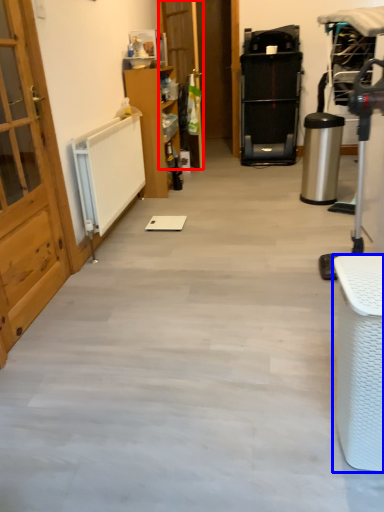
Question: Which object is further to the camera taking this photo, door (highlighted by a red box) or furniture (highlighted by a blue box)?

Choices:
 (A) door
 (B) furniture

Answer: (A)